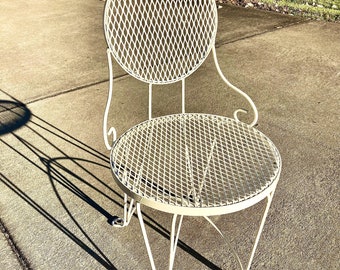
Where is `the back of white metal chair`? the back of white metal chair is located at coordinates (174, 24).